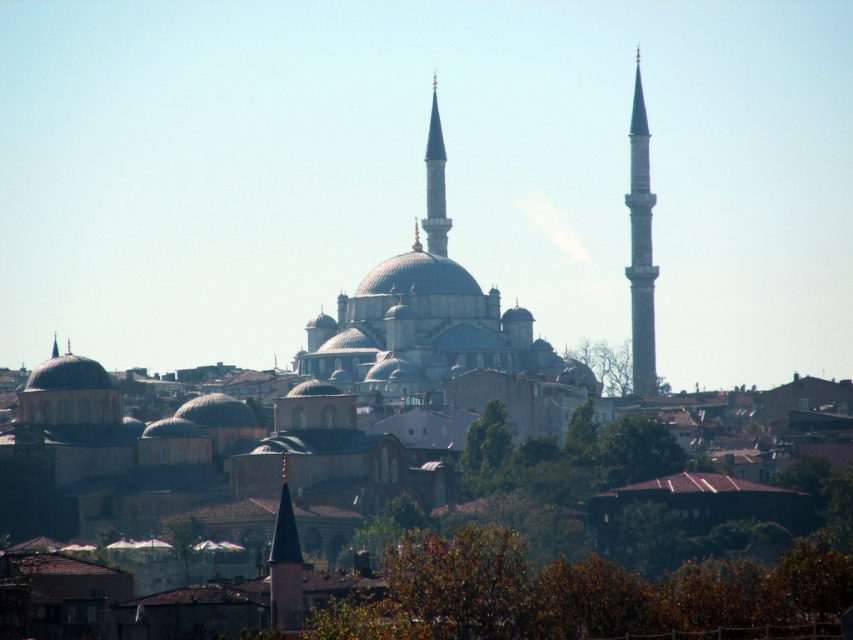
You are an architect assessing the structural integrity of the minarets in the cityscape. Given that the smooth gray minaret at right has a base width of 3 meters and the white marble minaret at center has a base width of 2.5 meters, which minaret has a larger base width?

The smooth gray minaret at right has a base width of 3 meters, which is larger than the white marble minaret at center with 2.5 meters. Therefore, the smooth gray minaret at right has a larger base width.